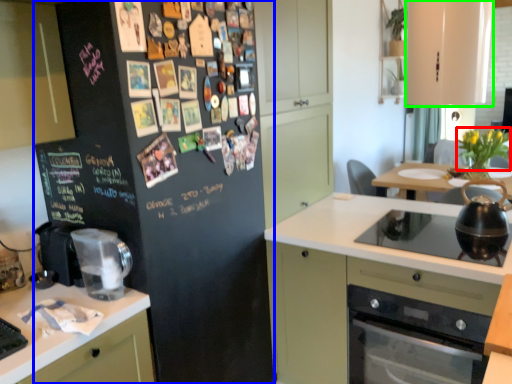
Question: Which object is positioned farthest from flower (highlighted by a red box)? Select from refrigerator (highlighted by a blue box) and cabinetry (highlighted by a green box).

Choices:
 (A) refrigerator
 (B) cabinetry

Answer: (A)